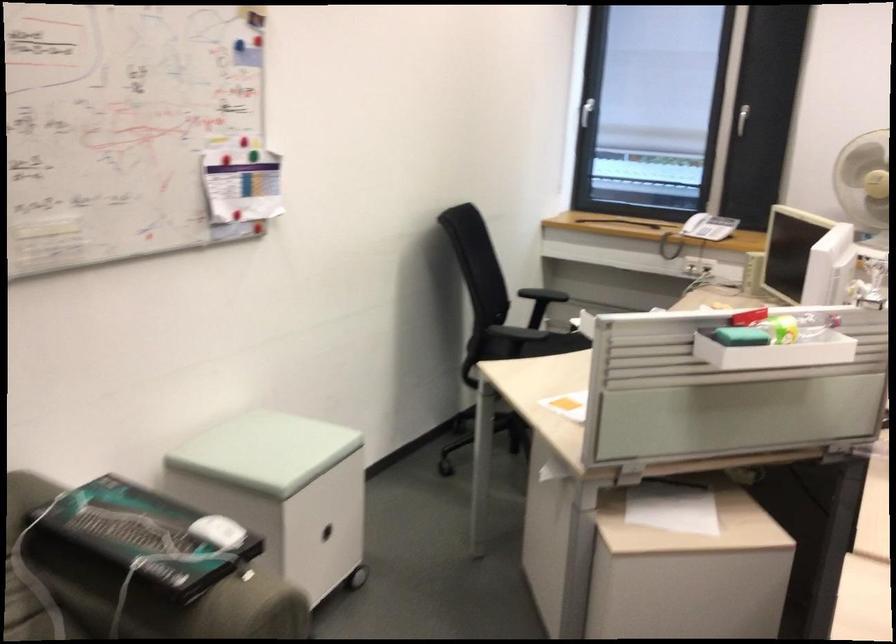
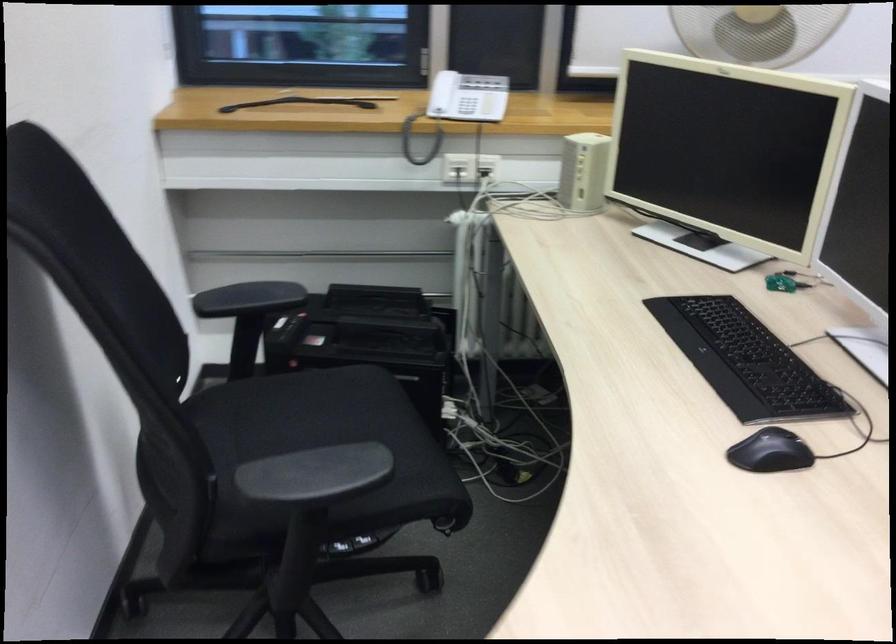
In the second image, find the point that corresponds to point 557,342 in the first image.

(309, 408)